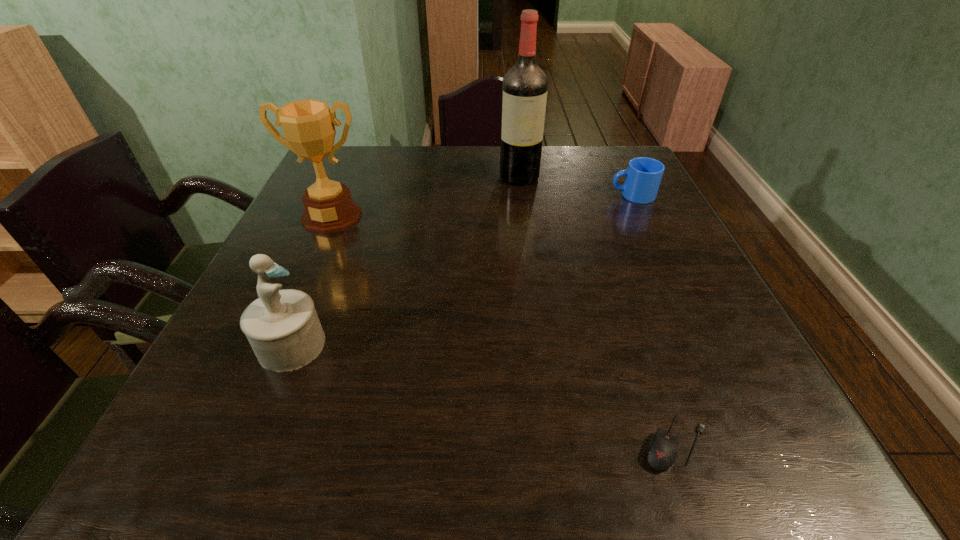
Identify which object is located as the second nearest to the third shortest object. Please provide its 2D coordinates. Your answer should be formatted as a tuple, i.e. [(x, y)], where the tuple contains the x and y coordinates of a point satisfying the conditions above.

[(662, 453)]

Where is `vacant space that satisfies the following two spatial constraints: 1. on the side of the rightmost object with the handle; 2. on the front-facing side of the fourth shortest object`? This screenshot has height=540, width=960. vacant space that satisfies the following two spatial constraints: 1. on the side of the rightmost object with the handle; 2. on the front-facing side of the fourth shortest object is located at coordinates (642, 216).

The width and height of the screenshot is (960, 540). I want to click on free space in the image that satisfies the following two spatial constraints: 1. on the side of the second shortest object with the handle; 2. on the front-facing side of the award, so click(642, 216).

I want to click on vacant space that satisfies the following two spatial constraints: 1. on the front-facing side of the tallest object; 2. on the left side of the mouse, so click(554, 443).

I want to click on vacant region that satisfies the following two spatial constraints: 1. on the front-facing side of the tallest object; 2. at the beak of the third tallest object, so click(x=541, y=345).

Where is `vacant region that satisfies the following two spatial constraints: 1. on the front-facing side of the award; 2. on the right side of the mouse`? The height and width of the screenshot is (540, 960). vacant region that satisfies the following two spatial constraints: 1. on the front-facing side of the award; 2. on the right side of the mouse is located at coordinates [x=232, y=443].